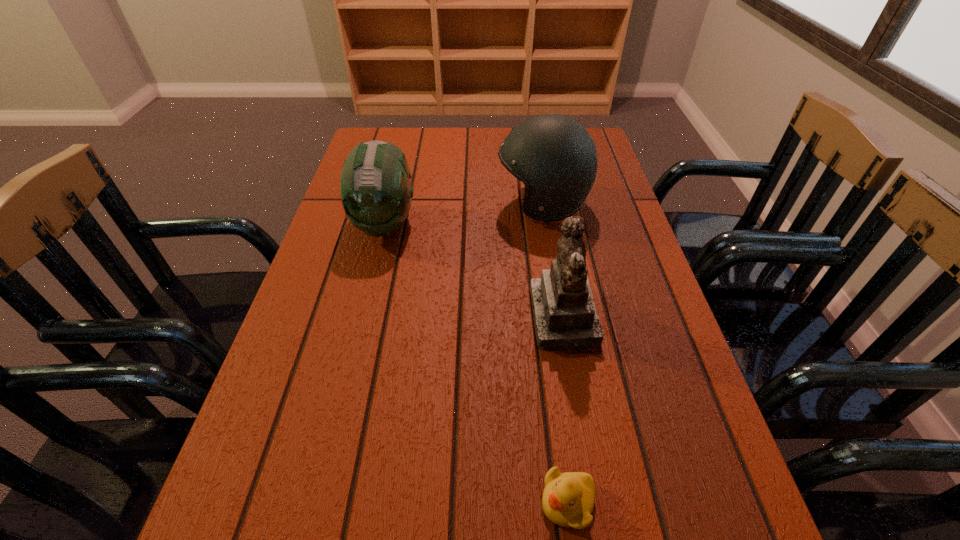
Where is `the right football helmet`? The height and width of the screenshot is (540, 960). the right football helmet is located at coordinates (554, 156).

You are a GUI agent. You are given a task and a screenshot of the screen. Output one action in this format:
    pyautogui.click(x=<x>, y=<y>)
    Task: Click on the second nearest object
    
    Given the screenshot: What is the action you would take?
    pyautogui.click(x=565, y=317)

Image resolution: width=960 pixels, height=540 pixels. I want to click on the shorter football helmet, so click(x=376, y=192).

This screenshot has width=960, height=540. Find the location of `the leftmost object`. the leftmost object is located at coordinates (376, 192).

The width and height of the screenshot is (960, 540). Identify the location of the shortest object. (568, 499).

This screenshot has width=960, height=540. Identify the location of the nearest object. (568, 499).

The image size is (960, 540). Identify the location of vacant space situated 0.380m at the face opening of the right football helmet. (353, 204).

Locate an element on the screen. The height and width of the screenshot is (540, 960). free region located 0.170m at the face opening of the right football helmet is located at coordinates (432, 204).

Find the location of `vacant space located 0.320m at the face opening of the right football helmet`. vacant space located 0.320m at the face opening of the right football helmet is located at coordinates (376, 204).

Locate an element on the screen. Image resolution: width=960 pixels, height=540 pixels. free spot located on the front-facing side of the figurine is located at coordinates (508, 319).